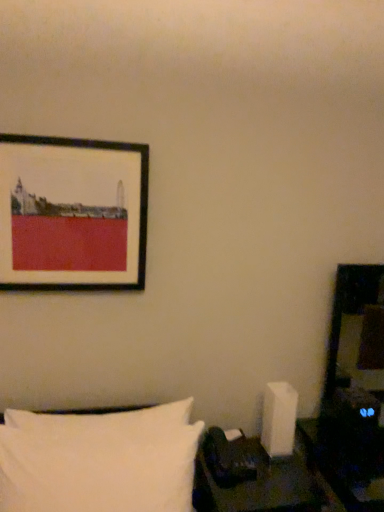
Question: Is point (120, 230) positioned closer to the camera than point (198, 459)?

Choices:
 (A) farther
 (B) closer

Answer: (A)

Question: Considering their positions, is matte black picture frame at upper left located in front of or behind black leather table at lower right?

Choices:
 (A) front
 (B) behind

Answer: (B)

Question: Which object is the closest to the white soft pillow at lower left?

Choices:
 (A) matte black picture frame at upper left
 (B) black leather table at lower right

Answer: (B)

Question: Estimate the real-world distances between objects in this image. Which object is farther from the white soft pillow at lower left?

Choices:
 (A) black leather table at lower right
 (B) matte black picture frame at upper left

Answer: (B)